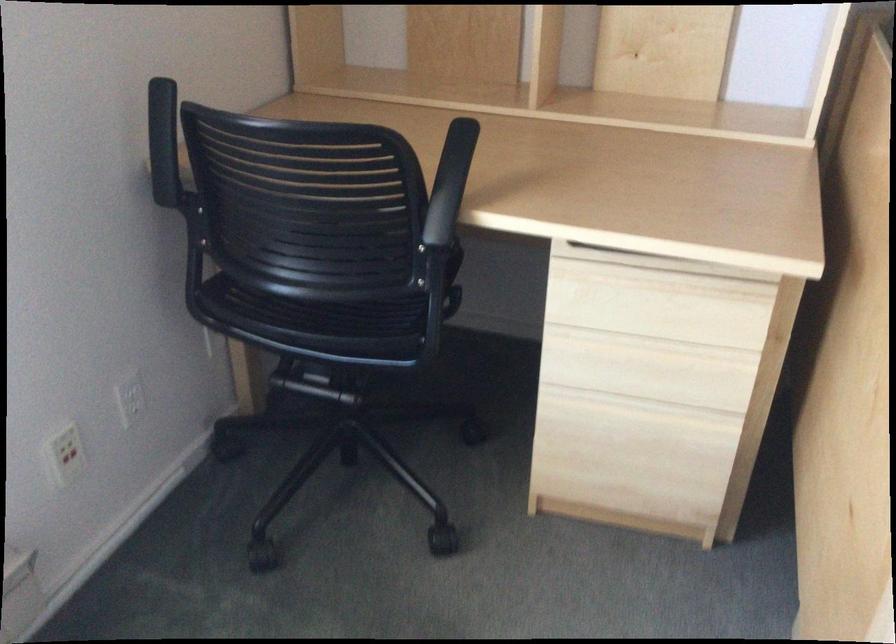
I want to click on chair sitting surface, so click(x=322, y=312).